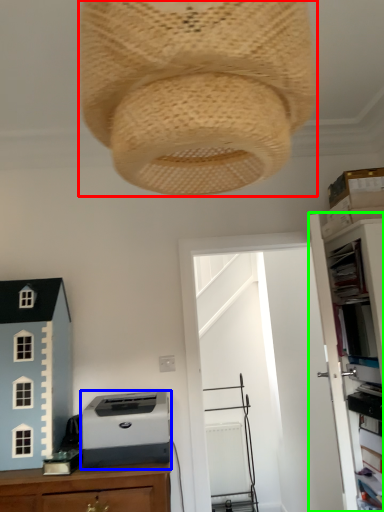
Question: Which object is the farthest from lamp (highlighted by a red box)? Choose among these: printer (highlighted by a blue box) or file cabinet (highlighted by a green box).

Choices:
 (A) printer
 (B) file cabinet

Answer: (B)